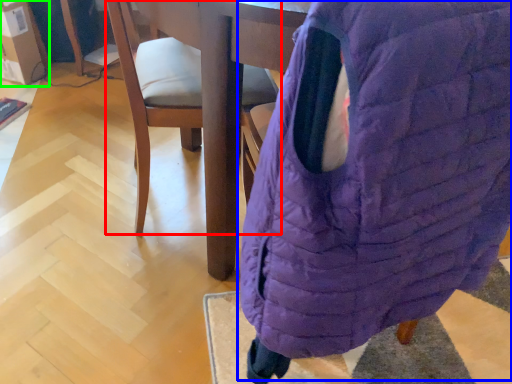
Question: Based on their relative distances, which object is farther from chair (highlighted by a red box)? Choose from bean bag chair (highlighted by a blue box) and cardboard box (highlighted by a green box).

Choices:
 (A) bean bag chair
 (B) cardboard box

Answer: (B)